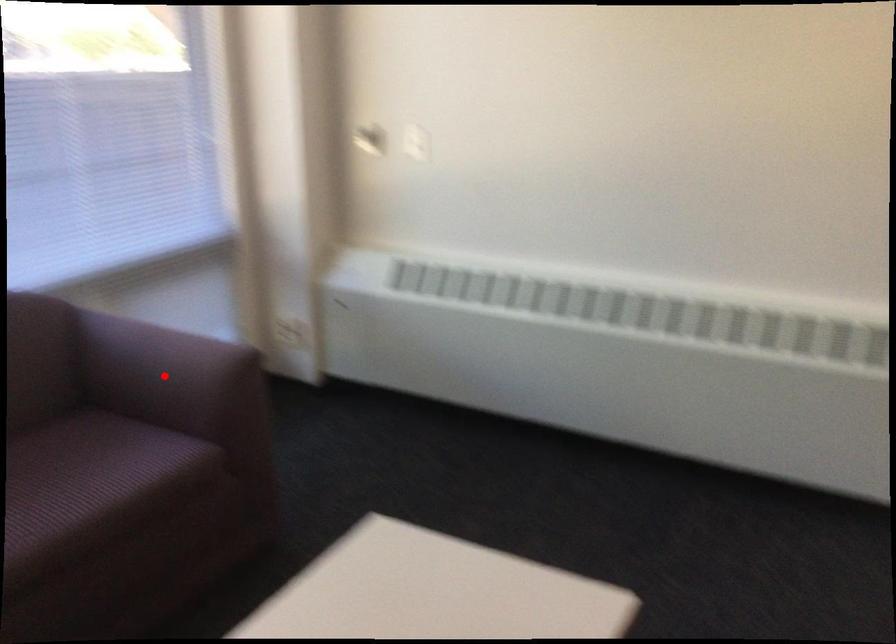
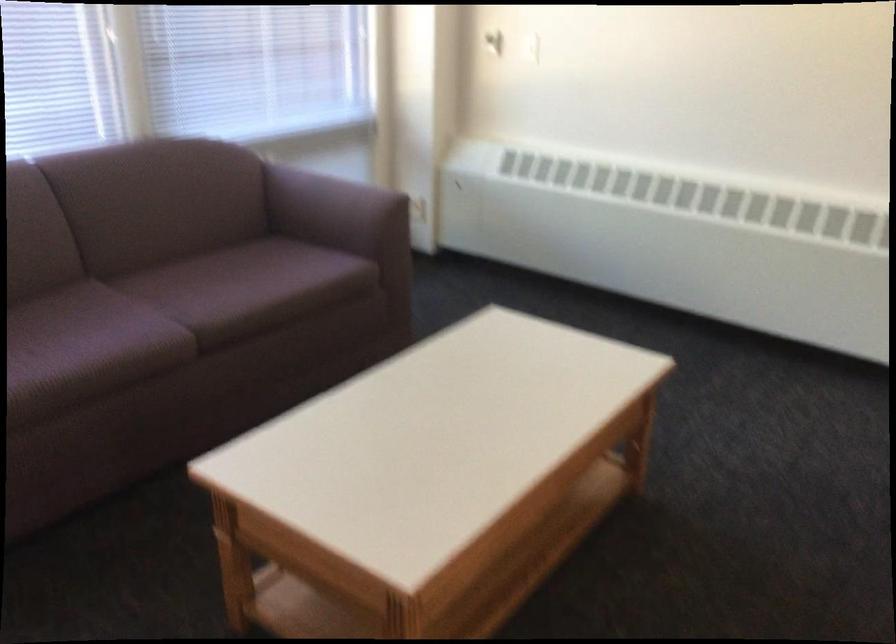
Question: I am providing you with two images of the same scene from different viewpoints. Given a red point in image1, look at the same physical point in image2. Is it:

Choices:
 (A) Closer to the viewpoint
 (B) Farther from the viewpoint

Answer: (B)